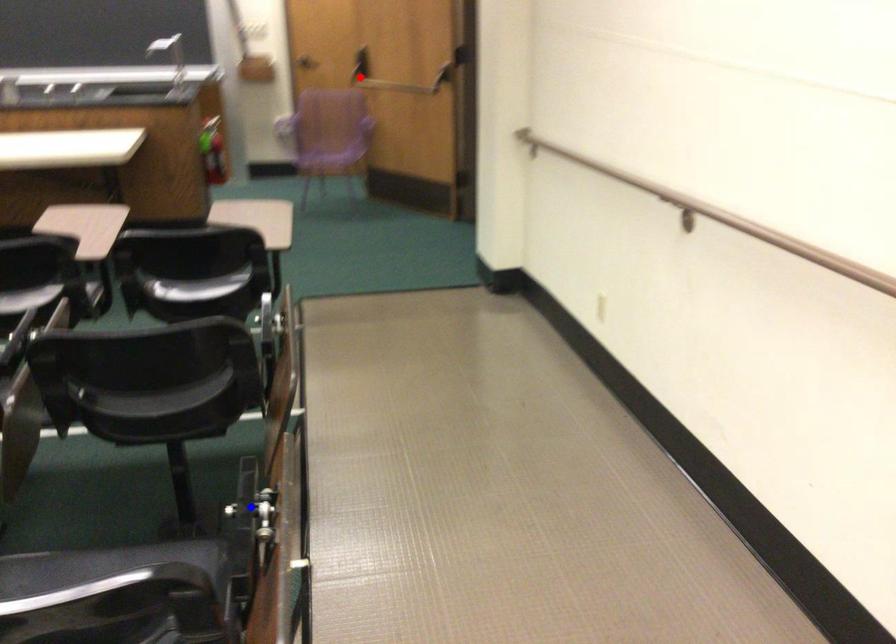
Question: Which of the two points in the image is closer to the camera?

Choices:
 (A) Blue point is closer.
 (B) Red point is closer.

Answer: (A)